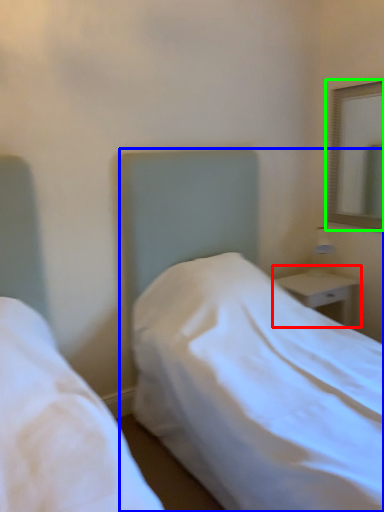
Question: Which object is positioned closest to nightstand (highlighted by a red box)? Select from bed (highlighted by a blue box) and mirror (highlighted by a green box).

Choices:
 (A) bed
 (B) mirror

Answer: (A)